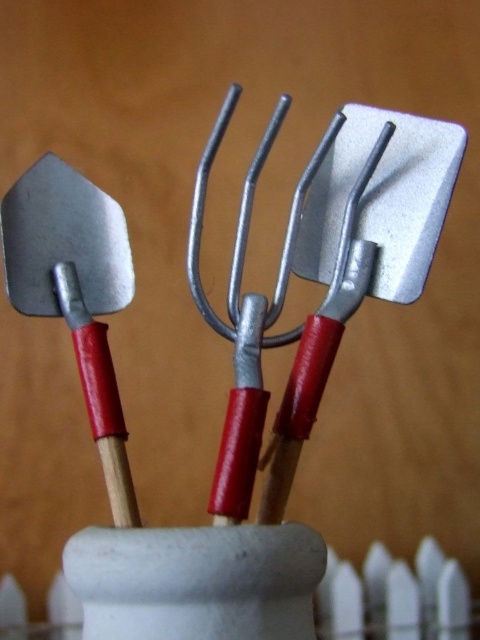
Question: Which point is closer to the camera?

Choices:
 (A) (408, 221)
 (B) (44, 268)

Answer: (A)

Question: Does metallic silver spatula at center have a larger size compared to matte silver shovel at left?

Choices:
 (A) no
 (B) yes

Answer: (B)

Question: Is metallic silver spatula at center further to camera compared to matte silver shovel at left?

Choices:
 (A) yes
 (B) no

Answer: (A)

Question: Which point appears farthest from the camera in this image?

Choices:
 (A) (408, 170)
 (B) (105, 424)

Answer: (A)

Question: Which object appears closest to the camera in this image?

Choices:
 (A) metallic silver spatula at center
 (B) matte silver shovel at left

Answer: (B)

Question: From the image, what is the correct spatial relationship of metallic silver spatula at center in relation to matte silver shovel at left?

Choices:
 (A) left
 (B) right

Answer: (B)